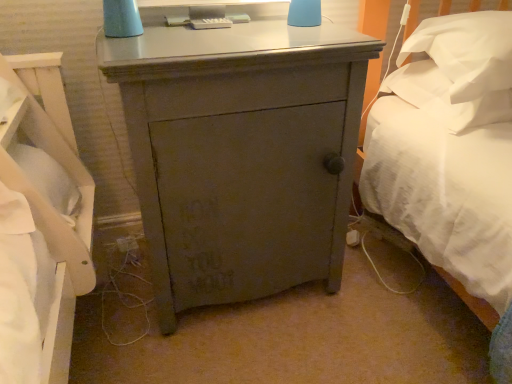
At what (x,y) coordinates should I click in order to perform the action: click on free spot in front of matte gray cabinet at center. Please return your answer as a coordinate pair (x, y). Looking at the image, I should click on (243, 353).